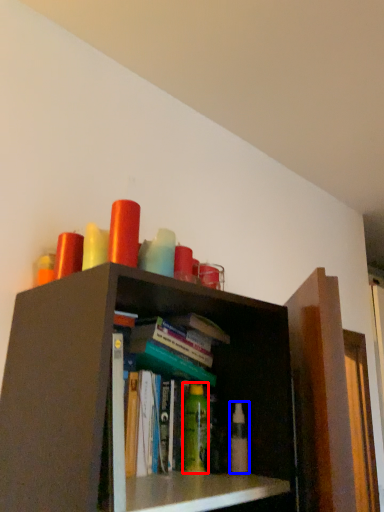
Question: Among these objects, which one is nearest to the camera, toiletry (highlighted by a red box) or toiletry (highlighted by a blue box)?

Choices:
 (A) toiletry
 (B) toiletry

Answer: (B)